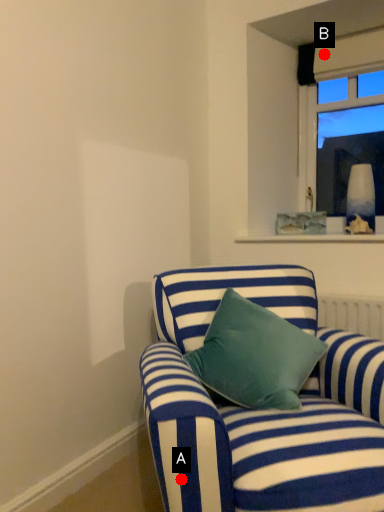
Question: Two points are circled on the image, labeled by A and B beside each circle. Which point is farther from the camera taking this photo?

Choices:
 (A) A is further
 (B) B is further

Answer: (B)